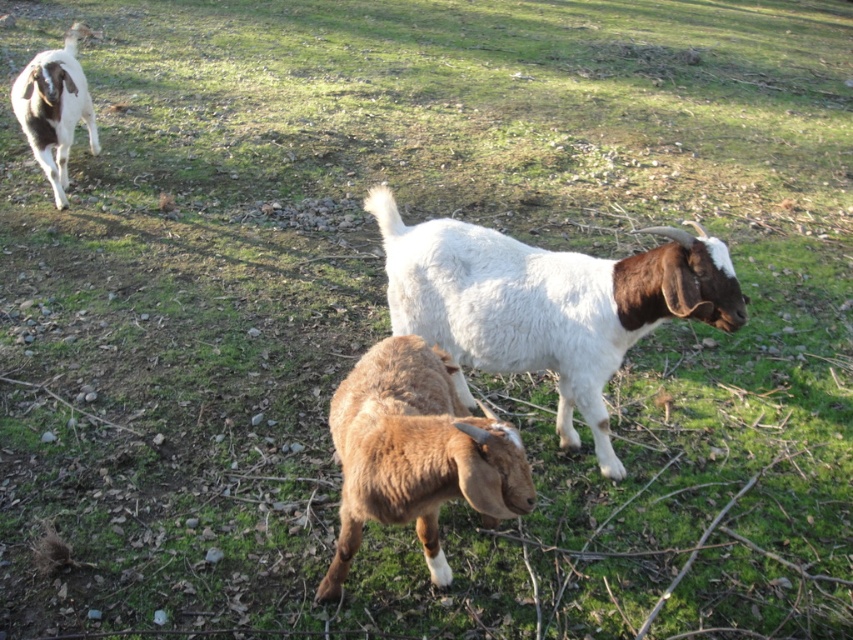
You are a farmer checking the size of your goats for a competition. You have a gate that is 1.2 meters wide. Can the white woolen goat at center and brown woolen goat at upper left both pass through the gate side by side?

The white woolen goat at center might be wider than brown woolen goat at upper left. If the white woolen goat at center is indeed wider than the brown woolen goat at upper left, their combined width could exceed the 1.2 meters gate. Therefore, they may not fit through side by side.

You are standing in the field and want to place a small fence between the two points, point (607,346) and point (432,464). Which point should the fence be closer to in order to be visible from where you are standing?

The fence should be closer to point (607,346) because it is closer to you than point (432,464).

You are a farmer checking the health of your goats. You notice the brown fuzzy goat at center and the brown woolen goat at upper left. Which goat has a thinner body?

The brown fuzzy goat at center is thinner than the brown woolen goat at upper left.